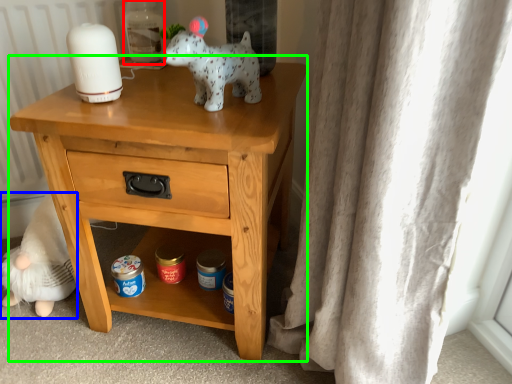
Question: Which object is the closest to the bottle (highlighted by a red box)? Choose among these: figurine (highlighted by a blue box) or nightstand (highlighted by a green box).

Choices:
 (A) figurine
 (B) nightstand

Answer: (B)